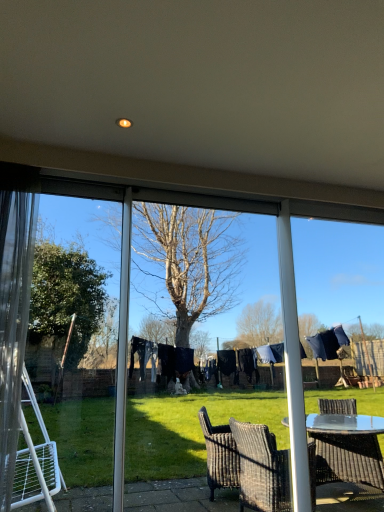
Question: Does transparent plastic screen door at center, which ranks as the 1th screen door in right-to-left order, touch transparent glass screen door at left, which ranks as the first screen door in left-to-right order?

Choices:
 (A) yes
 (B) no

Answer: (B)

Question: Is the depth of transparent plastic screen door at center, the second screen door viewed from the left, greater than that of transparent glass screen door at left, which ranks as the first screen door in left-to-right order?

Choices:
 (A) yes
 (B) no

Answer: (A)

Question: Is the position of transparent plastic screen door at center, the second screen door viewed from the left, less distant than that of transparent glass screen door at left, the second screen door from the right?

Choices:
 (A) no
 (B) yes

Answer: (A)

Question: Is transparent plastic screen door at center, the second screen door viewed from the left, to the right of transparent glass screen door at left, the second screen door from the right, from the viewer's perspective?

Choices:
 (A) no
 (B) yes

Answer: (B)

Question: Does transparent plastic screen door at center, which ranks as the 1th screen door in right-to-left order, have a greater width compared to transparent glass screen door at left, which ranks as the first screen door in left-to-right order?

Choices:
 (A) no
 (B) yes

Answer: (B)

Question: From a real-world perspective, is clear glass window frame at right physically located above or below transparent glass screen door at left, the second screen door from the right?

Choices:
 (A) above
 (B) below

Answer: (B)

Question: From the image's perspective, is clear glass window frame at right located above or below transparent glass screen door at left, the second screen door from the right?

Choices:
 (A) below
 (B) above

Answer: (A)

Question: In terms of height, does clear glass window frame at right look taller or shorter compared to transparent glass screen door at left, which ranks as the first screen door in left-to-right order?

Choices:
 (A) tall
 (B) short

Answer: (A)

Question: In terms of size, does clear glass window frame at right appear bigger or smaller than transparent glass screen door at left, which ranks as the first screen door in left-to-right order?

Choices:
 (A) small
 (B) big

Answer: (B)

Question: Based on their sizes in the image, would you say transparent plastic screen door at center, which ranks as the 1th screen door in right-to-left order, is bigger or smaller than clear glass window frame at right?

Choices:
 (A) big
 (B) small

Answer: (B)

Question: Is transparent plastic screen door at center, which ranks as the 1th screen door in right-to-left order, wider or thinner than clear glass window frame at right?

Choices:
 (A) thin
 (B) wide

Answer: (A)

Question: Considering the relative positions of transparent plastic screen door at center, the second screen door viewed from the left, and clear glass window frame at right in the image provided, is transparent plastic screen door at center, the second screen door viewed from the left, to the left or to the right of clear glass window frame at right?

Choices:
 (A) left
 (B) right

Answer: (A)

Question: Relative to clear glass window frame at right, is transparent plastic screen door at center, the second screen door viewed from the left, in front or behind?

Choices:
 (A) front
 (B) behind

Answer: (A)

Question: Is transparent glass screen door at left, the second screen door from the right, inside or outside of transparent plastic screen door at center, the second screen door viewed from the left?

Choices:
 (A) inside
 (B) outside

Answer: (B)

Question: In the image, is transparent glass screen door at left, which ranks as the first screen door in left-to-right order, positioned in front of or behind transparent plastic screen door at center, the second screen door viewed from the left?

Choices:
 (A) behind
 (B) front

Answer: (B)